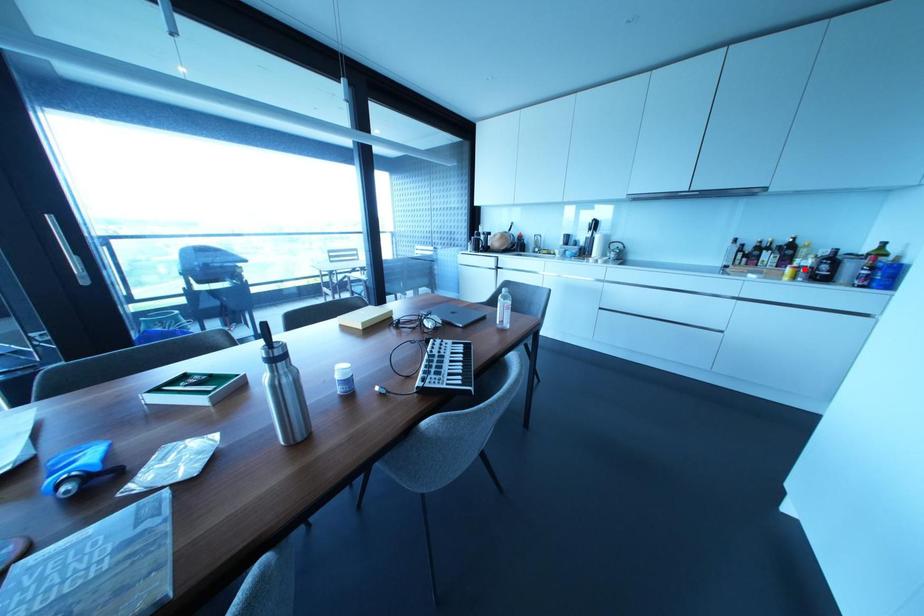
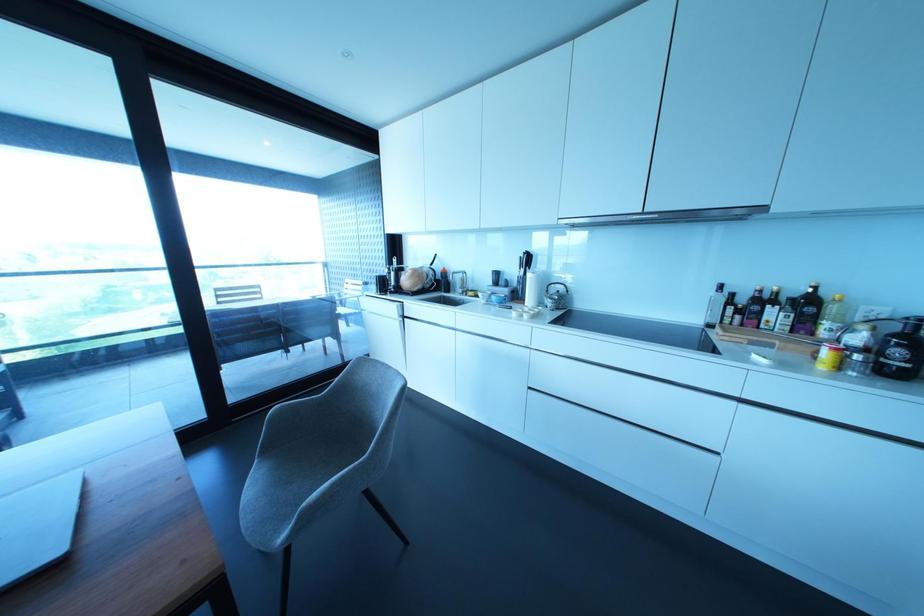
Locate, in the second image, the point that corresponds to the highlighted location in the first image.

(857, 357)